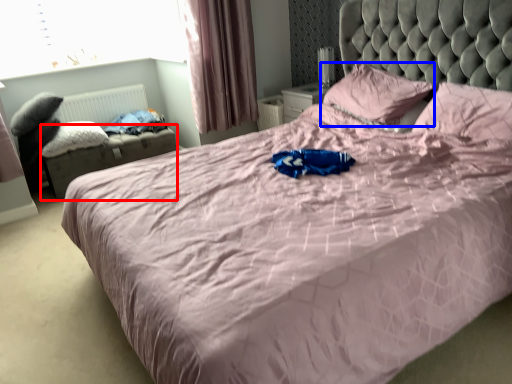
Question: Which point is closer to the camera, footrest (highlighted by a red box) or pillow (highlighted by a blue box)?

Choices:
 (A) footrest
 (B) pillow

Answer: (B)